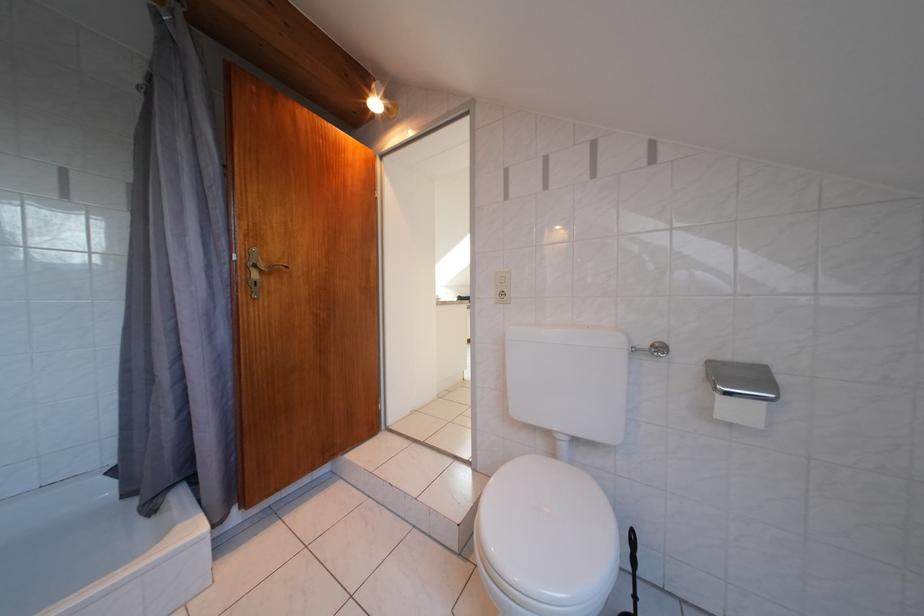
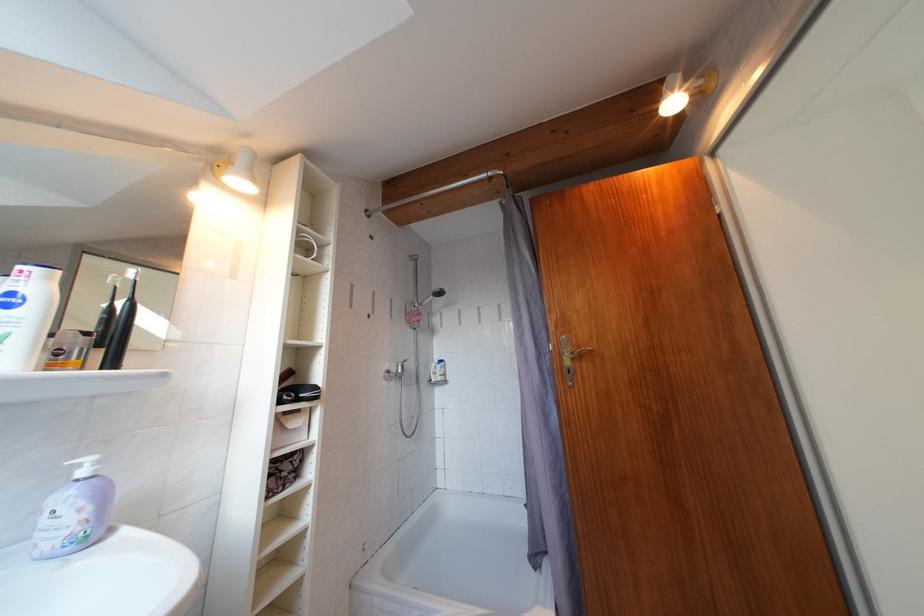
Question: The camera is either moving clockwise (left) or counter-clockwise (right) around the object. The first image is from the beginning of the video and the second image is from the end. Is the camera moving left or right when shooting the video?

Choices:
 (A) Left
 (B) Right

Answer: (B)